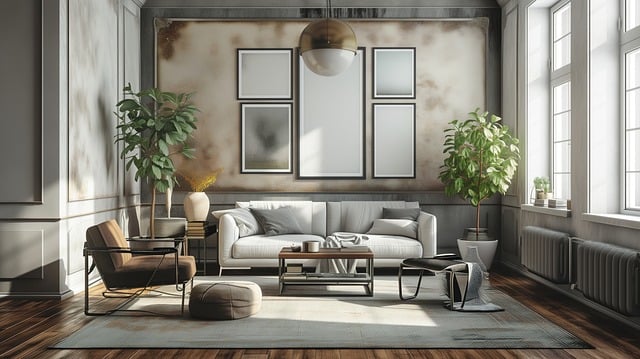
Find the location of a particular element. pictures is located at coordinates (259, 72), (272, 147), (351, 144), (394, 127), (387, 68).